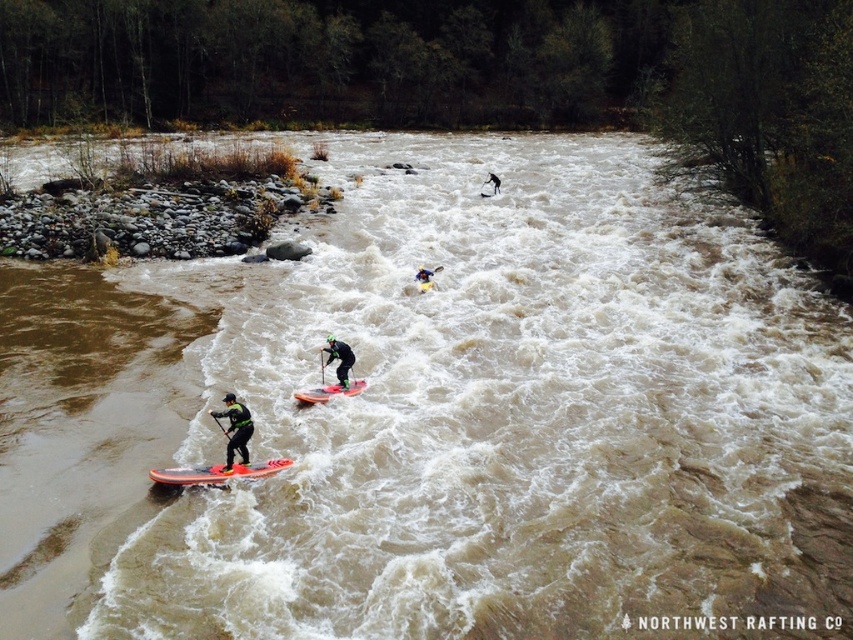
Can you confirm if orange matte surfboard at center is positioned to the right of black matte wetsuit at center?

Incorrect, orange matte surfboard at center is not on the right side of black matte wetsuit at center.

Is orange matte surfboard at center further to camera compared to black matte wetsuit at center?

No, it is not.

Which is in front, point (309, 394) or point (347, 358)?

Point (309, 394) is in front.

Where is `orange matte surfboard at center`? The height and width of the screenshot is (640, 853). orange matte surfboard at center is located at coordinates (329, 392).

Is point (282, 467) positioned in front of point (498, 179)?

Yes, it is.

Which is in front, point (224, 483) or point (489, 180)?

Point (224, 483) is more forward.

The width and height of the screenshot is (853, 640). In order to click on orange glossy surfboard at lower left in this screenshot , I will do point(216,472).

Does black rubber kayak at upper center have a greater width compared to orange glossy paddleboard at center?

Indeed, black rubber kayak at upper center has a greater width compared to orange glossy paddleboard at center.

Between black rubber kayak at upper center and orange glossy paddleboard at center, which one appears on the right side from the viewer's perspective?

From the viewer's perspective, black rubber kayak at upper center appears more on the right side.

I want to click on black rubber kayak at upper center, so click(x=492, y=180).

This screenshot has width=853, height=640. Find the location of `black rubber kayak at upper center`. black rubber kayak at upper center is located at coordinates (492, 180).